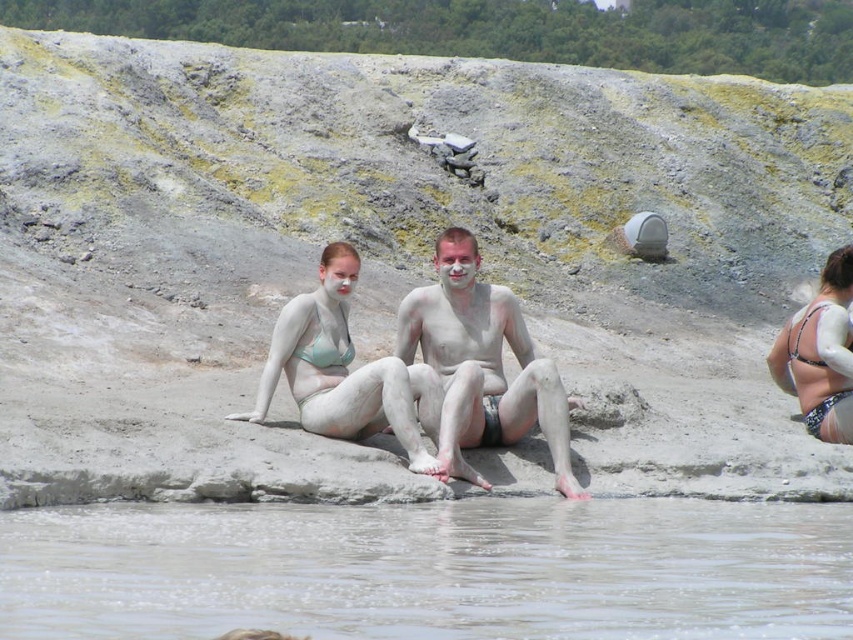
You are a photographer standing at the edge of the mud bath. You want to take a photo that includes both the clear mud at water center and the matte clay bikini at center. Given that your camera has a maximum zoom range of 8 meters, will you be able to capture both objects in the same frame without moving closer?

The clear mud at water center is 9.07 meters away from the matte clay bikini at center. Since the camera can only zoom up to 8 meters, it won that capture both objects in the same frame without moving closer.

You are standing at the edge of the mud bath and want to reach both points in the scene. Which point, point (296, 561) or point (827, 308), is closer to you?

Point (296, 561) is closer to the viewer than point (827, 308).